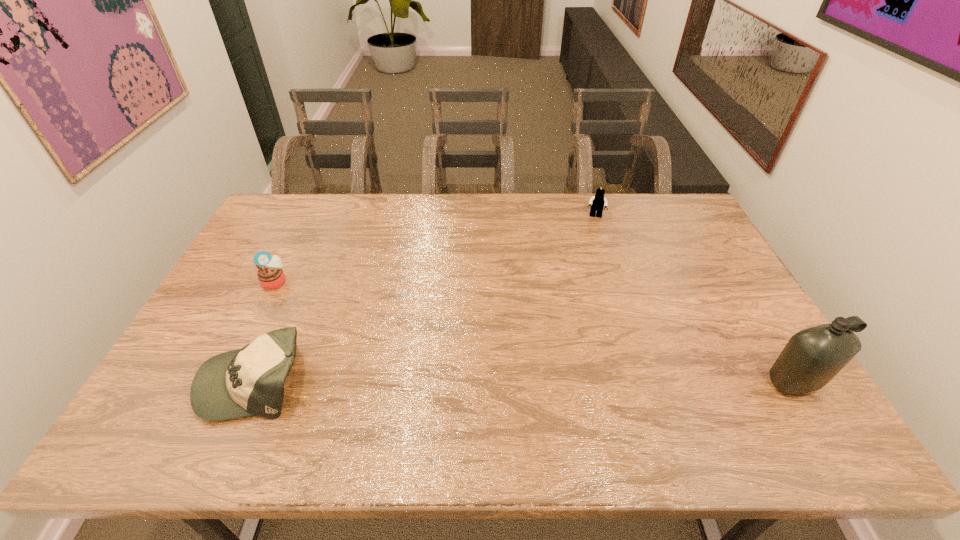
Where is `free space on the desktop that is between the baseball cap and the tallest object and is positioned on the front-facing side of the second farthest object`? The image size is (960, 540). free space on the desktop that is between the baseball cap and the tallest object and is positioned on the front-facing side of the second farthest object is located at coordinates (445, 380).

This screenshot has height=540, width=960. What are the coordinates of `free space on the desktop that is between the baseball cap and the bottle and is positioned on the front-facing side of the Lego` in the screenshot? It's located at (587, 381).